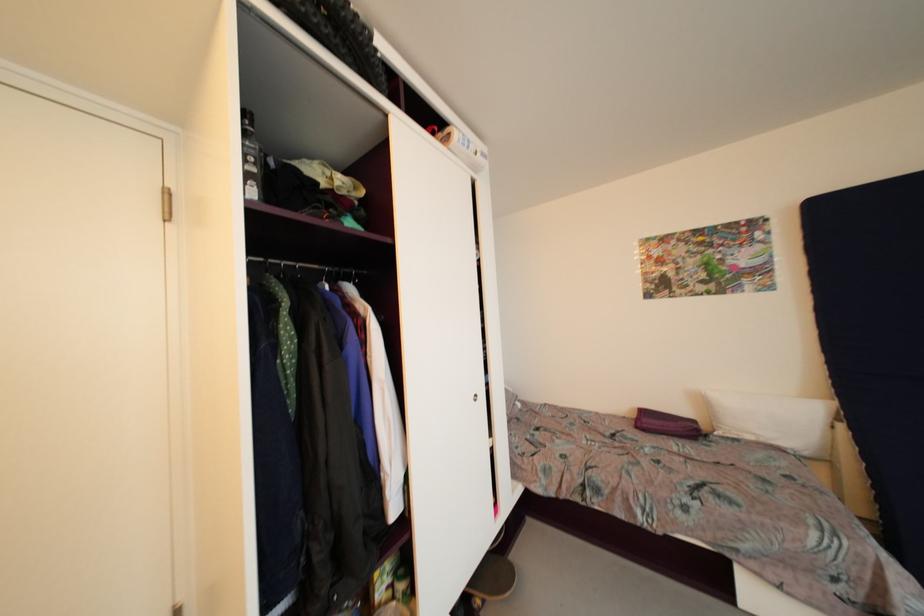
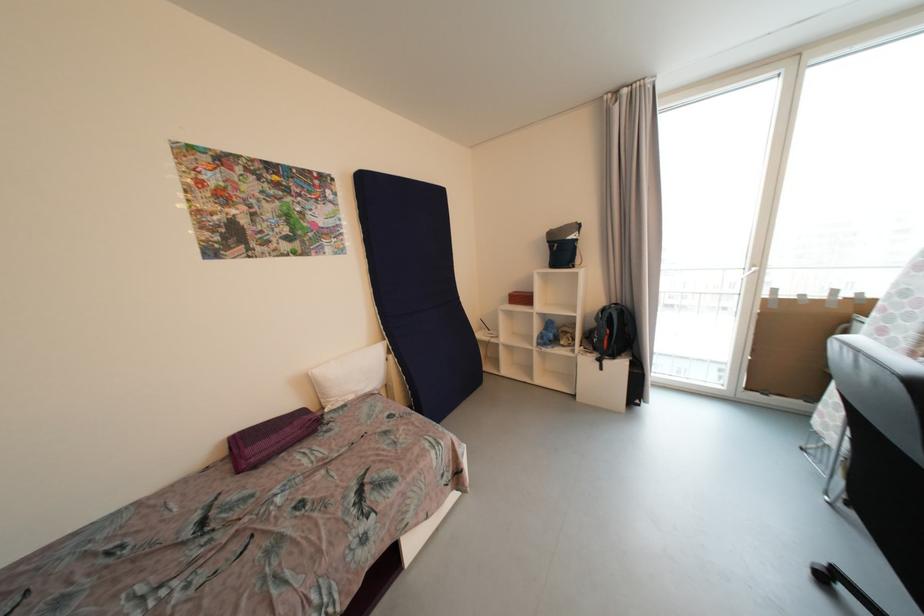
In the second image, find the point that corresponds to point (709, 403) in the first image.

(315, 386)